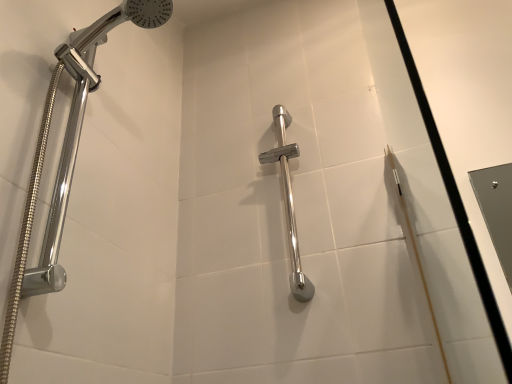
The width and height of the screenshot is (512, 384). Describe the element at coordinates (289, 202) in the screenshot. I see `polished chrome grab bar at center, placed as the second shower when sorted from front to back` at that location.

In order to click on polished chrome grab bar at center, which is the 1th shower from right to left in this screenshot , I will do `click(289, 202)`.

This screenshot has height=384, width=512. In order to click on polished chrome shower head at left, the 2th shower in the back-to-front sequence in this screenshot , I will do `click(77, 136)`.

What do you see at coordinates (77, 136) in the screenshot? I see `polished chrome shower head at left, the 1th shower in the front-to-back sequence` at bounding box center [77, 136].

Where is `polished chrome grab bar at center, acting as the 2th shower starting from the left`? The height and width of the screenshot is (384, 512). polished chrome grab bar at center, acting as the 2th shower starting from the left is located at coordinates click(x=289, y=202).

Does polished chrome shower head at left, the 1th shower in the front-to-back sequence, appear on the left side of polished chrome grab bar at center, which is the 1th shower from right to left?

Yes.

Considering the positions of objects polished chrome shower head at left, the 2th shower in the back-to-front sequence, and polished chrome grab bar at center, which ranks as the first shower in back-to-front order, in the image provided, who is in front, polished chrome shower head at left, the 2th shower in the back-to-front sequence, or polished chrome grab bar at center, which ranks as the first shower in back-to-front order,?

Positioned in front is polished chrome shower head at left, the 2th shower in the back-to-front sequence.

Between point (150, 9) and point (287, 210), which one is positioned in front?

Point (150, 9)

From the image's perspective, is polished chrome shower head at left, which appears as the second shower when viewed from the right, below polished chrome grab bar at center, which ranks as the first shower in back-to-front order?

Incorrect, from the image's perspective, polished chrome shower head at left, which appears as the second shower when viewed from the right, is higher than polished chrome grab bar at center, which ranks as the first shower in back-to-front order.

In the scene shown: From a real-world perspective, is polished chrome shower head at left, the 1th shower viewed from the left, below polished chrome grab bar at center, placed as the second shower when sorted from front to back?

Yes.

Between polished chrome shower head at left, the 1th shower viewed from the left, and polished chrome grab bar at center, acting as the 2th shower starting from the left, which one has smaller width?

polished chrome grab bar at center, acting as the 2th shower starting from the left.

Can you confirm if polished chrome shower head at left, the 1th shower in the front-to-back sequence, is taller than polished chrome grab bar at center, acting as the 2th shower starting from the left?

Correct, polished chrome shower head at left, the 1th shower in the front-to-back sequence, is much taller as polished chrome grab bar at center, acting as the 2th shower starting from the left.

Is polished chrome shower head at left, the 1th shower in the front-to-back sequence, bigger than polished chrome grab bar at center, which is the 1th shower from right to left?

Yes.

Would you say polished chrome grab bar at center, placed as the second shower when sorted from front to back, is part of polished chrome shower head at left, the 1th shower viewed from the left,'s contents?

That's incorrect, polished chrome grab bar at center, placed as the second shower when sorted from front to back, is not inside polished chrome shower head at left, the 1th shower viewed from the left.

Does polished chrome shower head at left, the 1th shower in the front-to-back sequence, touch polished chrome grab bar at center, placed as the second shower when sorted from front to back?

No, polished chrome shower head at left, the 1th shower in the front-to-back sequence, is not making contact with polished chrome grab bar at center, placed as the second shower when sorted from front to back.

Does polished chrome shower head at left, the 2th shower in the back-to-front sequence, turn towards polished chrome grab bar at center, which ranks as the first shower in back-to-front order?

No.

What's the angular difference between polished chrome shower head at left, the 1th shower in the front-to-back sequence, and polished chrome grab bar at center, which is the 1th shower from right to left,'s facing directions?

There is a 90.4-degree angle between the facing directions of polished chrome shower head at left, the 1th shower in the front-to-back sequence, and polished chrome grab bar at center, which is the 1th shower from right to left.

Where is `shower that is on the right side of polished chrome shower head at left, the 1th shower in the front-to-back sequence`? The height and width of the screenshot is (384, 512). shower that is on the right side of polished chrome shower head at left, the 1th shower in the front-to-back sequence is located at coordinates (289, 202).

Does polished chrome grab bar at center, which is the 1th shower from right to left, appear on the left side of polished chrome shower head at left, the 1th shower in the front-to-back sequence?

In fact, polished chrome grab bar at center, which is the 1th shower from right to left, is to the right of polished chrome shower head at left, the 1th shower in the front-to-back sequence.

Is polished chrome grab bar at center, placed as the second shower when sorted from front to back, in front of or behind polished chrome shower head at left, which appears as the second shower when viewed from the right, in the image?

polished chrome grab bar at center, placed as the second shower when sorted from front to back, is positioned farther from the viewer than polished chrome shower head at left, which appears as the second shower when viewed from the right.

Which point is more distant from viewer, (294, 157) or (169, 16)?

Positioned behind is point (294, 157).

From the image's perspective, is polished chrome grab bar at center, which ranks as the first shower in back-to-front order, beneath polished chrome shower head at left, the 1th shower in the front-to-back sequence?

Yes.

From a real-world perspective, is polished chrome grab bar at center, acting as the 2th shower starting from the left, below polished chrome shower head at left, the 1th shower viewed from the left?

No.

Does polished chrome grab bar at center, placed as the second shower when sorted from front to back, have a lesser width compared to polished chrome shower head at left, the 1th shower viewed from the left?

Yes.

Between polished chrome grab bar at center, which ranks as the first shower in back-to-front order, and polished chrome shower head at left, the 2th shower in the back-to-front sequence, which one has less height?

polished chrome grab bar at center, which ranks as the first shower in back-to-front order, is shorter.

Does polished chrome grab bar at center, placed as the second shower when sorted from front to back, have a larger size compared to polished chrome shower head at left, which appears as the second shower when viewed from the right?

Actually, polished chrome grab bar at center, placed as the second shower when sorted from front to back, might be smaller than polished chrome shower head at left, which appears as the second shower when viewed from the right.

Is polished chrome grab bar at center, placed as the second shower when sorted from front to back, located outside polished chrome shower head at left, the 1th shower viewed from the left?

That's correct, polished chrome grab bar at center, placed as the second shower when sorted from front to back, is outside of polished chrome shower head at left, the 1th shower viewed from the left.

Is polished chrome grab bar at center, placed as the second shower when sorted from front to back, touching polished chrome shower head at left, the 2th shower in the back-to-front sequence?

polished chrome grab bar at center, placed as the second shower when sorted from front to back, is not next to polished chrome shower head at left, the 2th shower in the back-to-front sequence, and they're not touching.

Is polished chrome grab bar at center, placed as the second shower when sorted from front to back, oriented away from polished chrome shower head at left, the 1th shower viewed from the left?

No, polished chrome grab bar at center, placed as the second shower when sorted from front to back,'s orientation is not away from polished chrome shower head at left, the 1th shower viewed from the left.

How different are the orientations of polished chrome grab bar at center, which ranks as the first shower in back-to-front order, and polished chrome shower head at left, the 1th shower viewed from the left, in degrees?

The angular difference between polished chrome grab bar at center, which ranks as the first shower in back-to-front order, and polished chrome shower head at left, the 1th shower viewed from the left, is 90.4 degrees.

How far apart are polished chrome grab bar at center, which ranks as the first shower in back-to-front order, and polished chrome shower head at left, the 2th shower in the back-to-front sequence?

polished chrome grab bar at center, which ranks as the first shower in back-to-front order, and polished chrome shower head at left, the 2th shower in the back-to-front sequence, are 21.83 inches apart.

Identify the location of shower on the left of the polished chrome grab bar at center, placed as the second shower when sorted from front to back. This screenshot has width=512, height=384. (77, 136).

Find the location of a particular element. This screenshot has width=512, height=384. shower positioned vertically above the polished chrome shower head at left, the 1th shower viewed from the left (from a real-world perspective) is located at coordinates (289, 202).

Where is `shower below the polished chrome grab bar at center, placed as the second shower when sorted from front to back (from a real-world perspective)`? This screenshot has height=384, width=512. shower below the polished chrome grab bar at center, placed as the second shower when sorted from front to back (from a real-world perspective) is located at coordinates (77, 136).